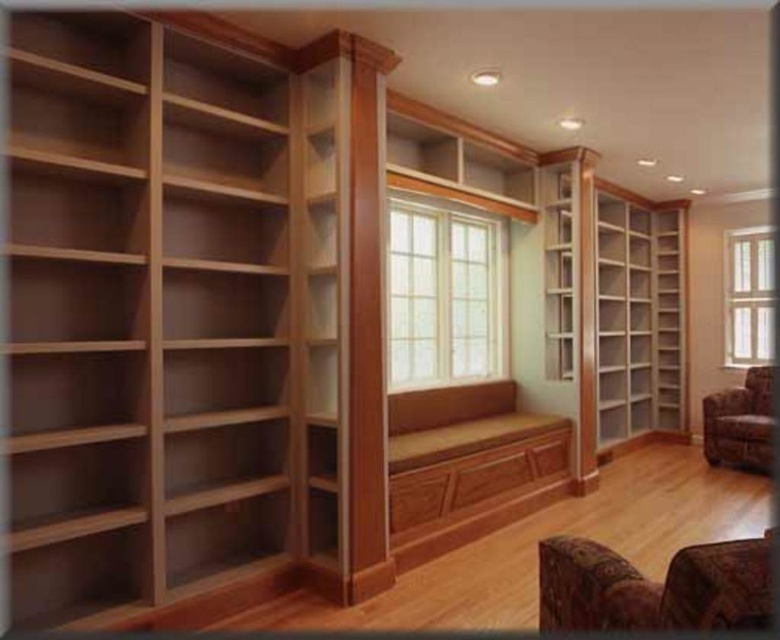
You are standing in the room and want to place a 3 feet wide painting on the wall between the light brown wood bookshelf at left and the window seat. Can you determine if there is enough space between them to fit the painting?

The light brown wood bookshelf at left is 7.77 feet from viewer. The window seat is part of the shelving unit which spans the wall, so the distance between them may vary. However, since the bookshelf is positioned at the left and the window seat is centrally located, the space between them is likely sufficient to accommodate a 3 feet wide painting.

You are moving a large potted plant that is 1.2 meters wide. You want to place it between the light brown wood bookshelf at left and the light brown wood bookshelf at right. Can the space between them accommodate the plant?

The light brown wood bookshelf at left is bigger than light brown wood bookshelf at right. However, the description does not provide the exact distance between them. Therefore, it is uncertain whether the space can accommodate the plant.

You are moving a large painting that is 1.2 meters wide into this room. You want to place it above either the light brown wood bookshelf at left or the velvet floral armchair at lower right. Based on their widths, which location would be more suitable for the painting?

The light brown wood bookshelf at left has a greater width than the velvet floral armchair at lower right, so placing the painting above the light brown wood bookshelf at left would be more suitable as it can accommodate the 1.2 meter wide painting better.